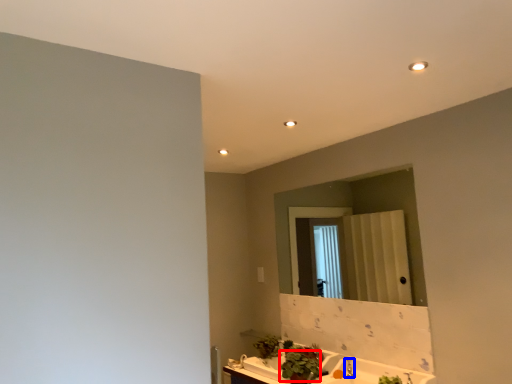
Question: Among these objects, which one is farthest to the camera, plant (highlighted by a red box) or faucet (highlighted by a blue box)?

Choices:
 (A) plant
 (B) faucet

Answer: (B)